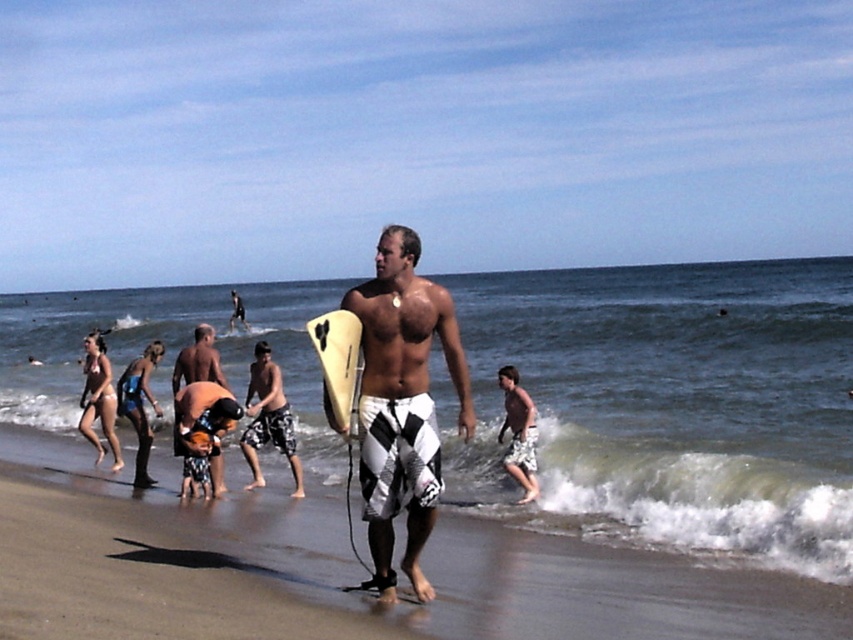
Question: Is white checkered shorts at center further to camera compared to white checkered boardshorts at center?

Choices:
 (A) yes
 (B) no

Answer: (B)

Question: Among these points, which one is nearest to the camera?

Choices:
 (A) (277, 442)
 (B) (234, 292)
 (C) (328, 376)

Answer: (C)

Question: Does white checkered shorts at center appear over camouflage shorts at center?

Choices:
 (A) yes
 (B) no

Answer: (B)

Question: Does clear blue water at center appear on the right side of camouflage shorts at center?

Choices:
 (A) no
 (B) yes

Answer: (B)

Question: Among these points, which one is nearest to the camera?

Choices:
 (A) [x=355, y=385]
 (B) [x=252, y=472]
 (C) [x=753, y=595]

Answer: (A)

Question: Which of these objects is positioned closest to the white checkered shorts at center?

Choices:
 (A) white checkered boardshorts at center
 (B) yellow foam surfboard at center
 (C) camouflage shorts at center
 (D) clear blue water at center

Answer: (A)